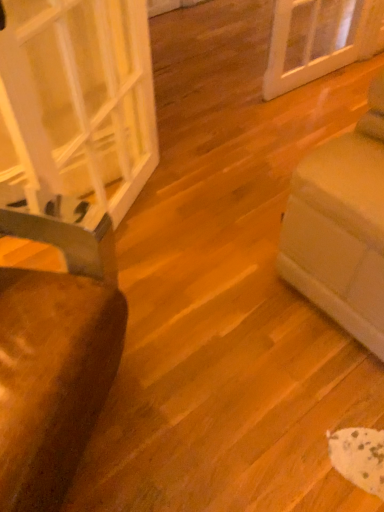
Question: In terms of width, does transparent glass door at left look wider or thinner when compared to brown fabric chair at left?

Choices:
 (A) wide
 (B) thin

Answer: (B)

Question: In the image, is transparent glass door at left on the left side or the right side of brown fabric chair at left?

Choices:
 (A) right
 (B) left

Answer: (A)

Question: Considering their positions, is transparent glass door at left located in front of or behind brown fabric chair at left?

Choices:
 (A) front
 (B) behind

Answer: (B)

Question: From a real-world perspective, is brown fabric chair at left positioned above or below transparent glass door at left?

Choices:
 (A) below
 (B) above

Answer: (A)

Question: Considering the positions of point (19, 500) and point (125, 11), is point (19, 500) closer or farther from the camera than point (125, 11)?

Choices:
 (A) farther
 (B) closer

Answer: (B)

Question: Is brown fabric chair at left taller or shorter than transparent glass door at left?

Choices:
 (A) tall
 (B) short

Answer: (B)

Question: Is brown fabric chair at left wider or thinner than transparent glass door at left?

Choices:
 (A) thin
 (B) wide

Answer: (B)